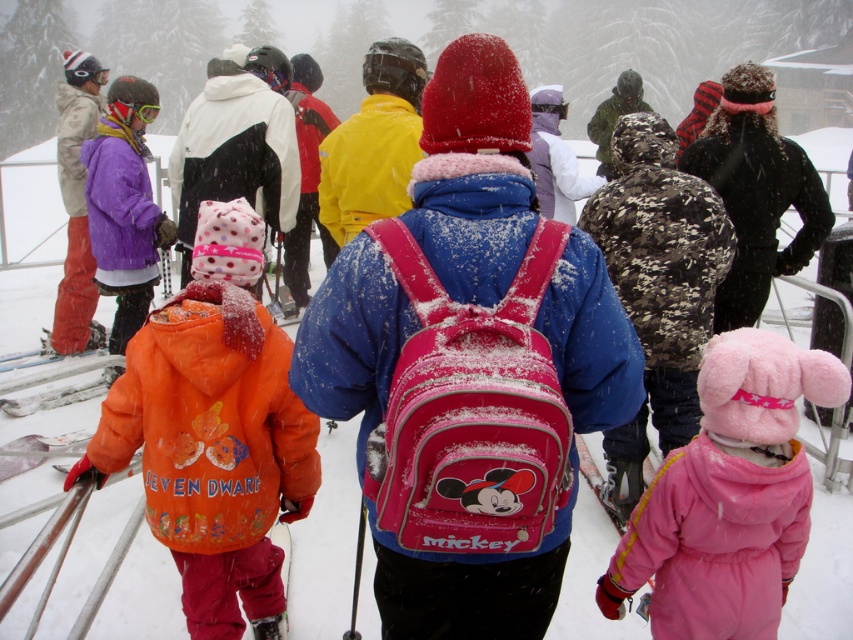
Which is behind, point (189, 336) or point (770, 234)?

Point (770, 234)

Is point (134, 388) more distant than point (701, 177)?

That is False.

Find the location of a particular element. orange fleece jacket at center is located at coordinates (213, 432).

Locate an element on the screen. The width and height of the screenshot is (853, 640). orange fleece jacket at center is located at coordinates (213, 432).

Locate an element on the screen. This screenshot has height=640, width=853. pink fluffy snowsuit at lower right is located at coordinates (728, 497).

Which of these two, pink fluffy snowsuit at lower right or white plastic ski at lower left, stands taller?

pink fluffy snowsuit at lower right is taller.

The image size is (853, 640). In order to click on pink fluffy snowsuit at lower right in this screenshot , I will do `click(728, 497)`.

Who is positioned more to the left, orange fleece jacket at center or pink fluffy snowsuit at lower right?

orange fleece jacket at center is more to the left.

Which is in front, point (221, 344) or point (726, 508)?

Point (726, 508)

Find the location of a particular element. Image resolution: width=853 pixels, height=640 pixels. orange fleece jacket at center is located at coordinates (213, 432).